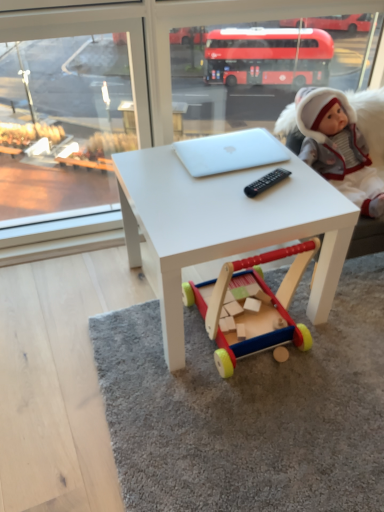
Where is `free point to the left of white matte table at center`? free point to the left of white matte table at center is located at coordinates (61, 310).